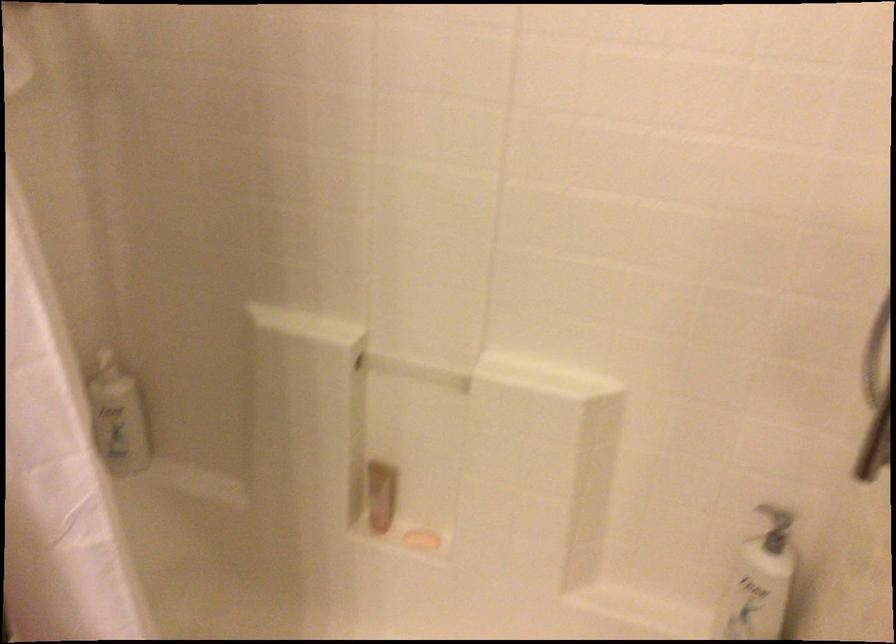
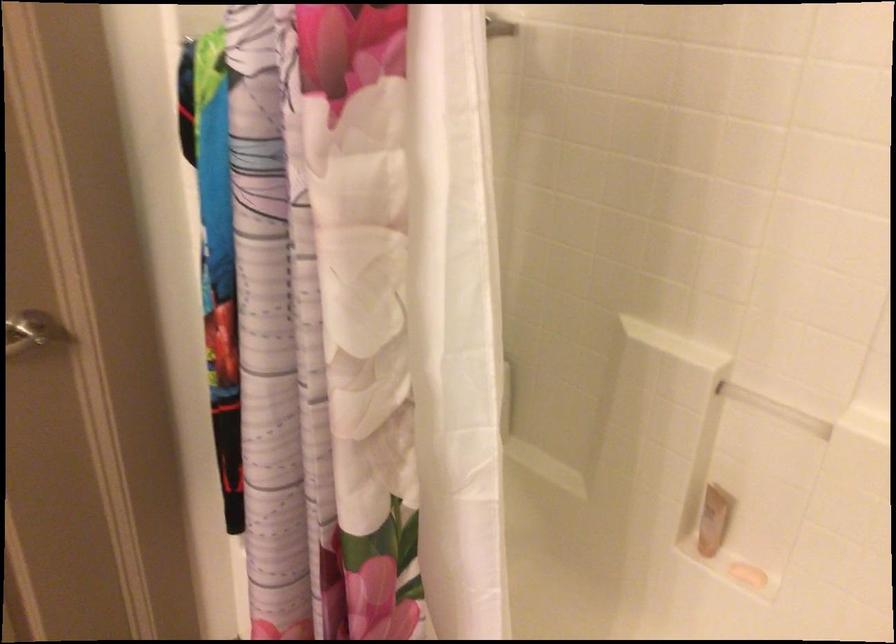
Question: The camera is either moving clockwise (left) or counter-clockwise (right) around the object. The first image is from the beginning of the video and the second image is from the end. Is the camera moving left or right when shooting the video?

Choices:
 (A) Left
 (B) Right

Answer: (B)